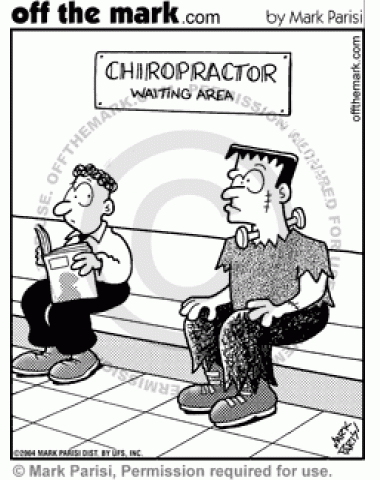
Find the location of a particular element. This screenshot has height=480, width=380. tiled floor is located at coordinates (104, 425).